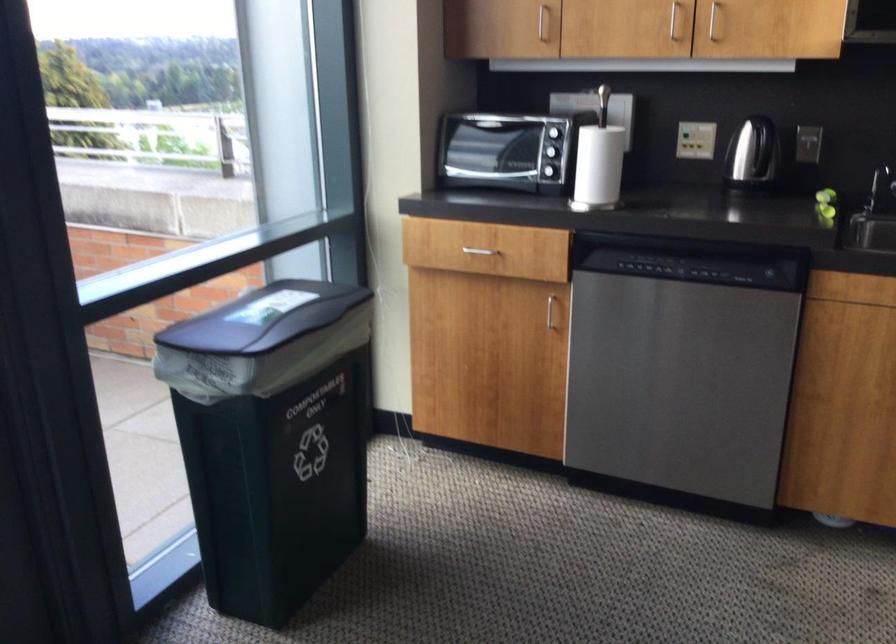
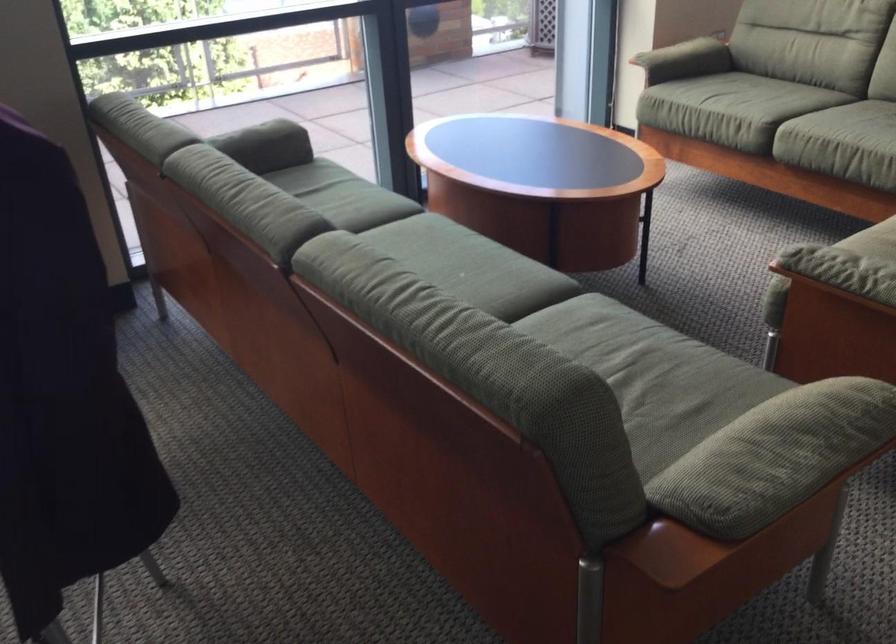
Question: Which direction would the cameraman need to move to produce the second image? Reply with the corresponding letter.

Choices:
 (A) Left
 (B) Right
 (C) Forward
 (D) Backward

Answer: (D)